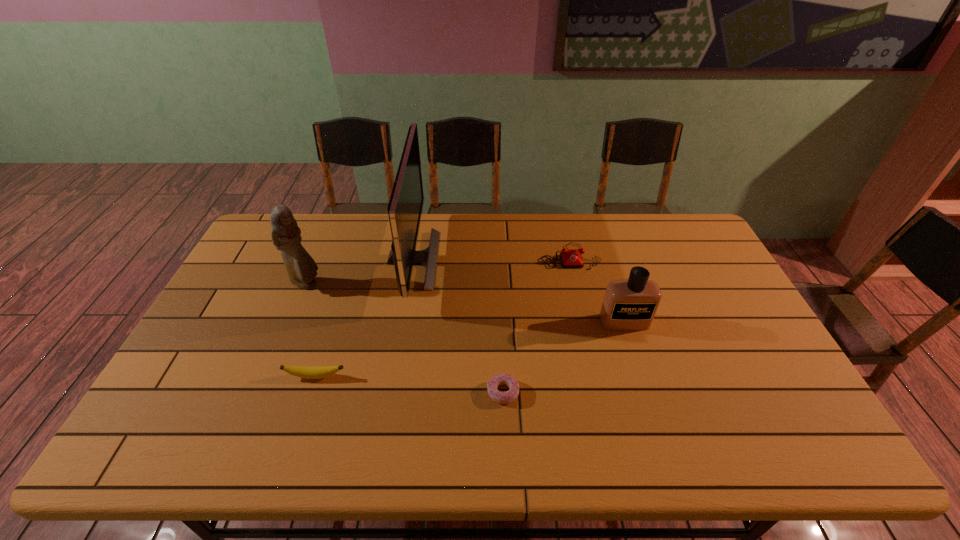
The image size is (960, 540). I want to click on vacant space located on the front label of the fourth shortest object, so click(x=662, y=443).

This screenshot has height=540, width=960. I want to click on free spot located 0.060m on the dial of the telephone, so click(575, 282).

Where is `free space located on the left of the banana`? This screenshot has width=960, height=540. free space located on the left of the banana is located at coordinates (189, 376).

Find the location of `vacant space located 0.070m on the front of the doughnut`. vacant space located 0.070m on the front of the doughnut is located at coordinates (505, 433).

Where is `monitor that is at the far edge`? monitor that is at the far edge is located at coordinates (405, 207).

Find the location of a particular element. telephone that is at the far edge is located at coordinates (570, 258).

Where is `free space at the far edge of the desktop`? free space at the far edge of the desktop is located at coordinates (517, 221).

Image resolution: width=960 pixels, height=540 pixels. In the image, there is a desktop. In order to click on free region at the near edge in this screenshot , I will do `click(458, 453)`.

In the image, there is a desktop. Where is `vacant space at the left edge`? vacant space at the left edge is located at coordinates tap(269, 281).

Identify the location of free region at the right edge. (722, 330).